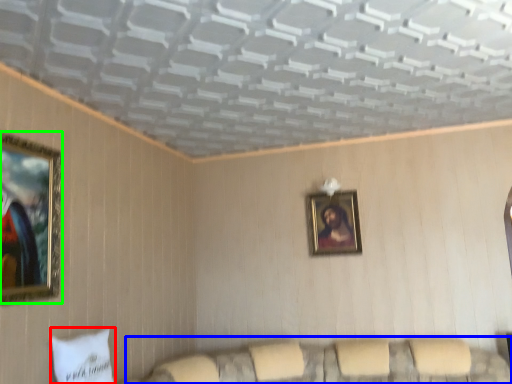
Question: Based on their relative distances, which object is nearer to pillow (highlighted by a red box)? Choose from couch (highlighted by a blue box) and picture frame (highlighted by a green box).

Choices:
 (A) couch
 (B) picture frame

Answer: (B)